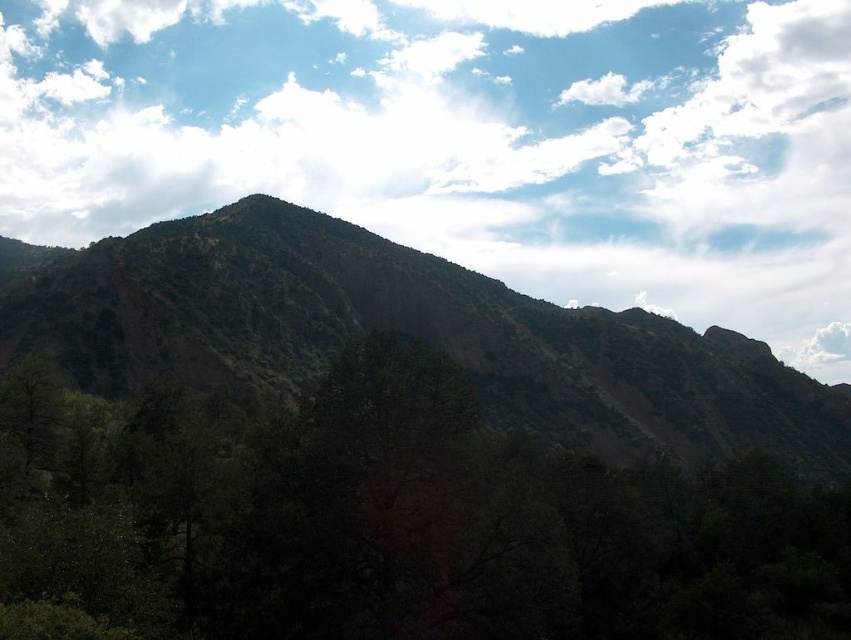
You are a hiker standing at the base of the mountain. You see a green leafy tree at center and a green textured hillside at center. How far apart are these two landmarks?

The distance between the green leafy tree at center and the green textured hillside at center is 61.16 meters.

You are standing at the base of the mountain and looking up. Which object is closer to you, the white fluffy cloud at upper center or the green leafy tree at center?

The white fluffy cloud at upper center is closer to you because it is positioned further to the viewer than the green leafy tree at center, meaning it appears nearer in the visual perspective.